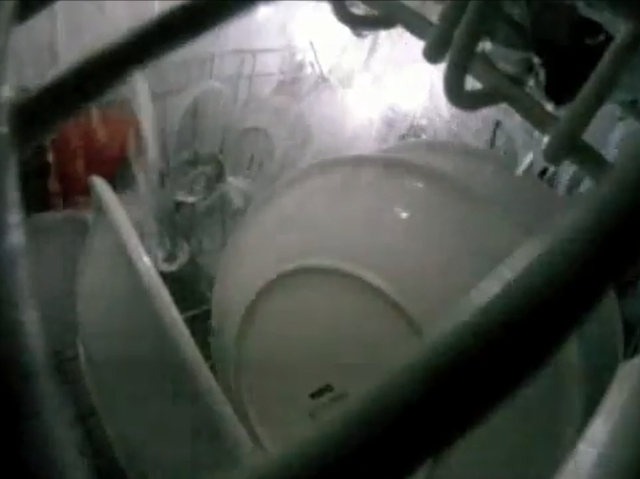
I want to click on bars of the rack, so click(570, 291), click(156, 46), click(29, 5), click(40, 387), click(593, 96).